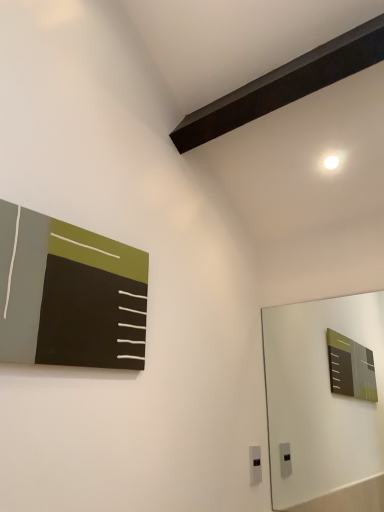
The image size is (384, 512). Describe the element at coordinates (69, 294) in the screenshot. I see `matte black board at upper left` at that location.

Locate an element on the screen. matte black board at upper left is located at coordinates (69, 294).

In order to face black plastic electric outlet at lower center, should I rotate leftwards or rightwards?

Turn right approximately 8.700 degrees to face it.

What is the approximate width of black plastic electric outlet at lower center?

The width of black plastic electric outlet at lower center is 0.81 inches.

Where is `black plastic electric outlet at lower center`? black plastic electric outlet at lower center is located at coordinates pos(255,465).

What do you see at coordinates (255, 465) in the screenshot? I see `black plastic electric outlet at lower center` at bounding box center [255, 465].

Image resolution: width=384 pixels, height=512 pixels. What are the coordinates of `matte black board at upper left` in the screenshot? It's located at (69, 294).

In the image, is black plastic electric outlet at lower center on the left side or the right side of matte black board at upper left?

In the image, black plastic electric outlet at lower center appears on the right side of matte black board at upper left.

Considering the positions of objects black plastic electric outlet at lower center and matte black board at upper left in the image provided, who is behind, black plastic electric outlet at lower center or matte black board at upper left?

black plastic electric outlet at lower center is more distant.

Does point (255, 460) appear closer or farther from the camera than point (44, 239)?

Point (255, 460) is farther from the camera than point (44, 239).

From the image's perspective, who appears lower, black plastic electric outlet at lower center or matte black board at upper left?

black plastic electric outlet at lower center appears lower in the image.

From a real-world perspective, between black plastic electric outlet at lower center and matte black board at upper left, who is vertically higher?

From a 3D spatial view, matte black board at upper left is above.

Does black plastic electric outlet at lower center have a greater width compared to matte black board at upper left?

In fact, black plastic electric outlet at lower center might be narrower than matte black board at upper left.

Based on the photo, can you confirm if black plastic electric outlet at lower center is shorter than matte black board at upper left?

Indeed, black plastic electric outlet at lower center has a lesser height compared to matte black board at upper left.

Between black plastic electric outlet at lower center and matte black board at upper left, which one has larger size?

Bigger between the two is matte black board at upper left.

Is black plastic electric outlet at lower center positioned beyond the bounds of matte black board at upper left?

Absolutely, black plastic electric outlet at lower center is external to matte black board at upper left.

Is black plastic electric outlet at lower center in contact with matte black board at upper left?

No, black plastic electric outlet at lower center is not with matte black board at upper left.

Is black plastic electric outlet at lower center facing towards matte black board at upper left?

No, black plastic electric outlet at lower center is not turned towards matte black board at upper left.

What's the angular difference between black plastic electric outlet at lower center and matte black board at upper left's facing directions?

0.965 degrees.

Identify the location of electric outlet that is behind the matte black board at upper left. (255, 465).

Which is more to the right, matte black board at upper left or black plastic electric outlet at lower center?

Positioned to the right is black plastic electric outlet at lower center.

Considering their positions, is matte black board at upper left located in front of or behind black plastic electric outlet at lower center?

matte black board at upper left is positioned closer to the viewer than black plastic electric outlet at lower center.

Which point is more distant from viewer, (17, 350) or (258, 469)?

The point (258, 469) is farther.

From the image's perspective, which object appears higher, matte black board at upper left or black plastic electric outlet at lower center?

matte black board at upper left appears higher in the image.

From a real-world perspective, who is located higher, matte black board at upper left or black plastic electric outlet at lower center?

matte black board at upper left, from a real-world perspective.

Does matte black board at upper left have a greater width compared to black plastic electric outlet at lower center?

Indeed, matte black board at upper left has a greater width compared to black plastic electric outlet at lower center.

Is matte black board at upper left shorter than black plastic electric outlet at lower center?

No.

Does matte black board at upper left have a smaller size compared to black plastic electric outlet at lower center?

No, matte black board at upper left is not smaller than black plastic electric outlet at lower center.

Is matte black board at upper left situated inside black plastic electric outlet at lower center or outside?

matte black board at upper left is outside black plastic electric outlet at lower center.

Does matte black board at upper left touch black plastic electric outlet at lower center?

No, matte black board at upper left is not with black plastic electric outlet at lower center.

Could you tell me if matte black board at upper left is turned towards black plastic electric outlet at lower center?

No, matte black board at upper left is not turned towards black plastic electric outlet at lower center.

How different are the orientations of matte black board at upper left and black plastic electric outlet at lower center in degrees?

The angle between the facing direction of matte black board at upper left and the facing direction of black plastic electric outlet at lower center is 0.965 degrees.

How far apart are matte black board at upper left and black plastic electric outlet at lower center?

They are 1.08 meters apart.

Where is `electric outlet below the matte black board at upper left (from a real-world perspective)`? This screenshot has width=384, height=512. electric outlet below the matte black board at upper left (from a real-world perspective) is located at coordinates (255, 465).

Image resolution: width=384 pixels, height=512 pixels. I want to click on electric outlet to the right of matte black board at upper left, so click(x=255, y=465).

Identify the location of electric outlet that appears behind the matte black board at upper left. The height and width of the screenshot is (512, 384). (255, 465).